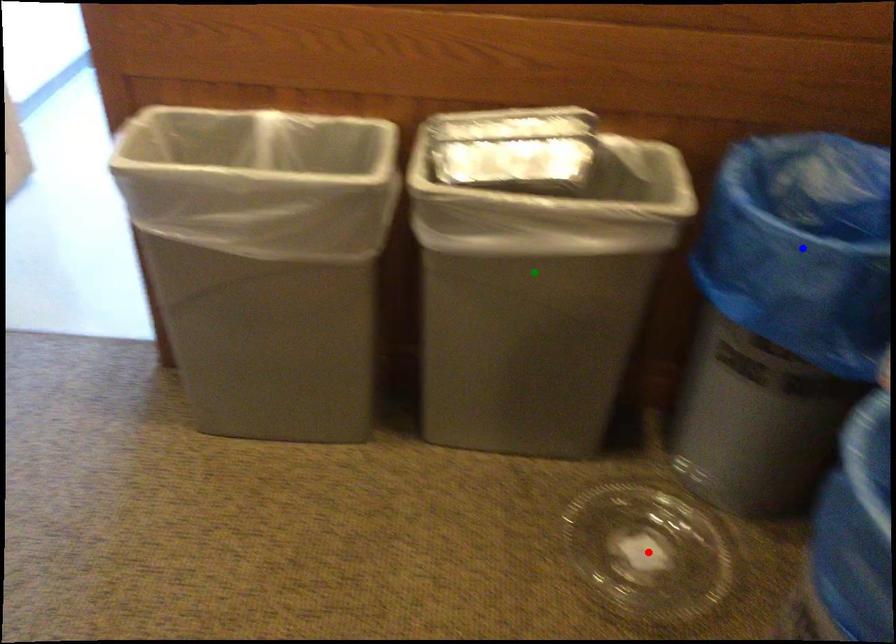
Order these from nearest to farthest:
blue point
green point
red point

1. blue point
2. green point
3. red point